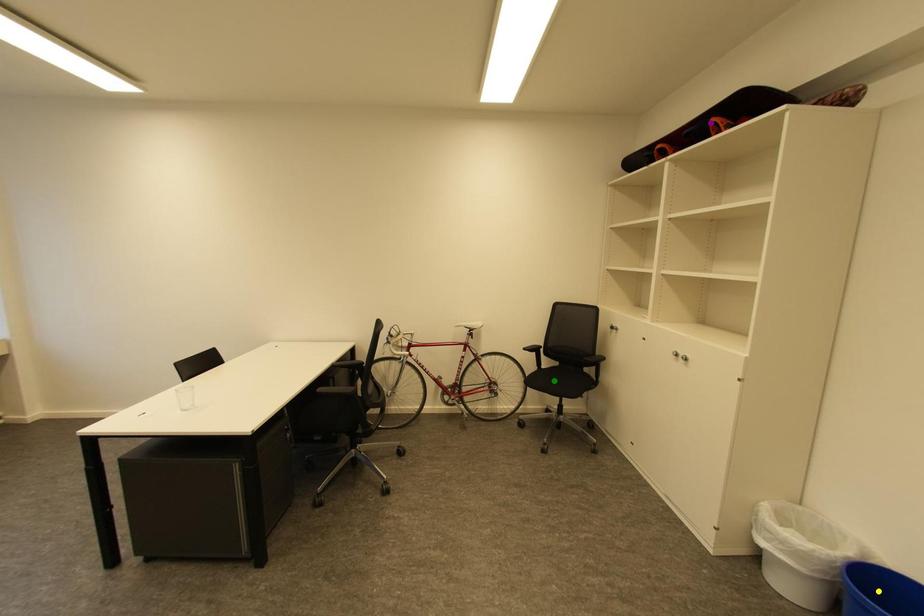
Order these from nearest to farthest:
- yellow point
- purple point
- green point

yellow point, purple point, green point